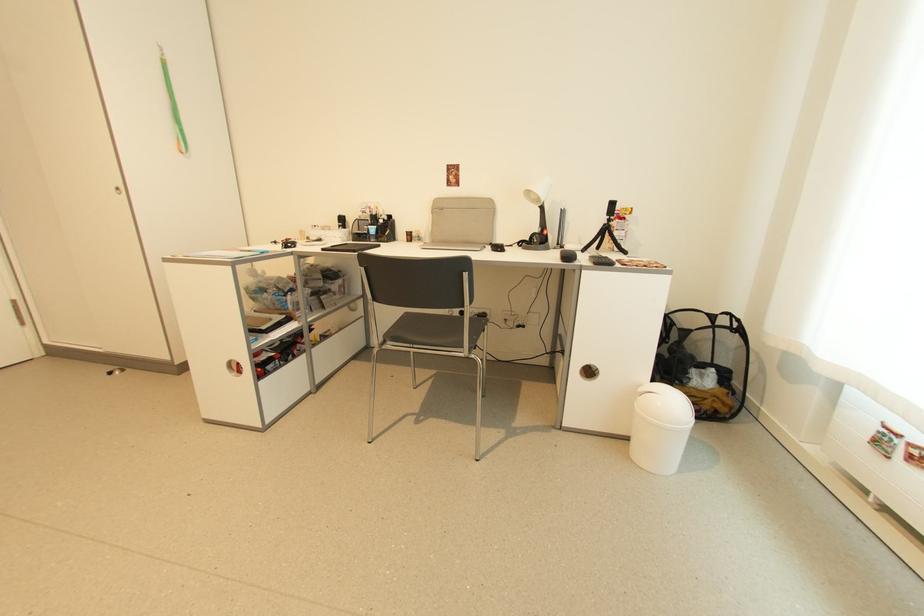
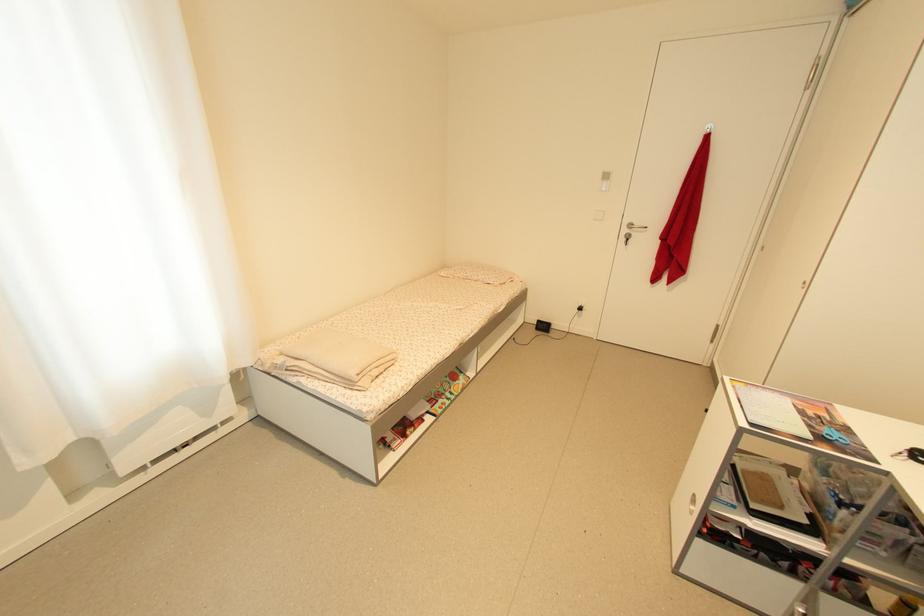
The first image is from the beginning of the video and the second image is from the end. How did the camera likely rotate when shooting the video?

The rotation direction of the camera is left-down.